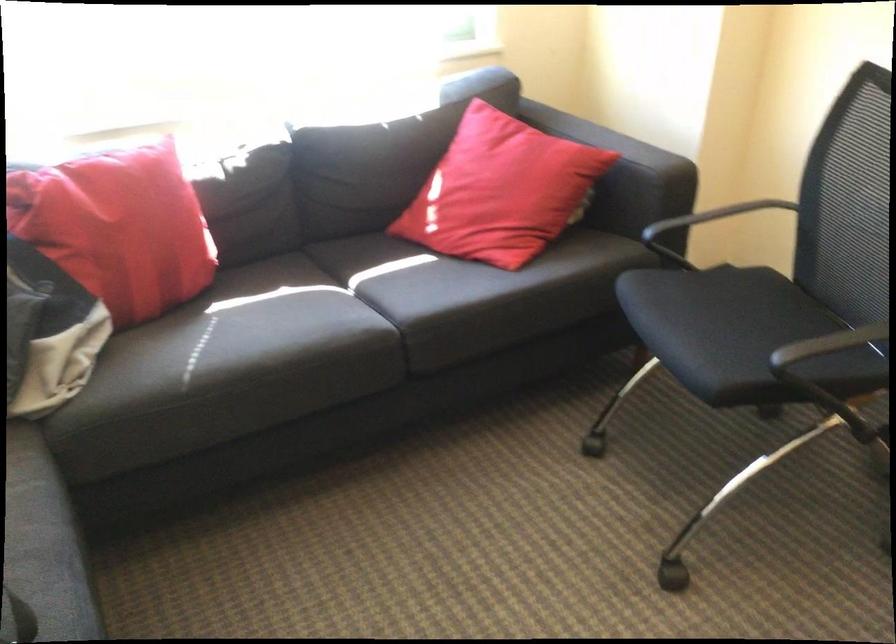
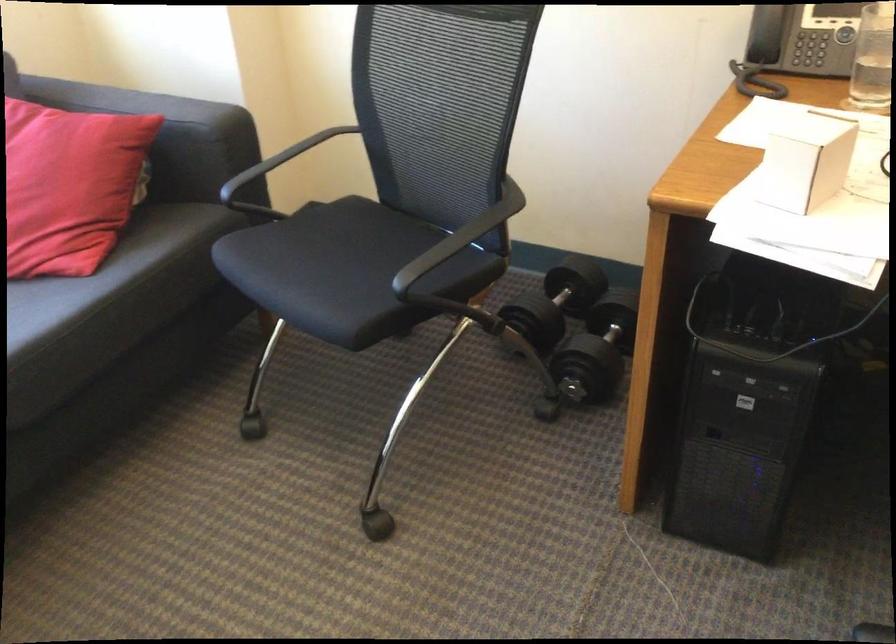
Question: How did the camera likely rotate?

Choices:
 (A) Left
 (B) Right
 (C) Up
 (D) Down

Answer: (B)